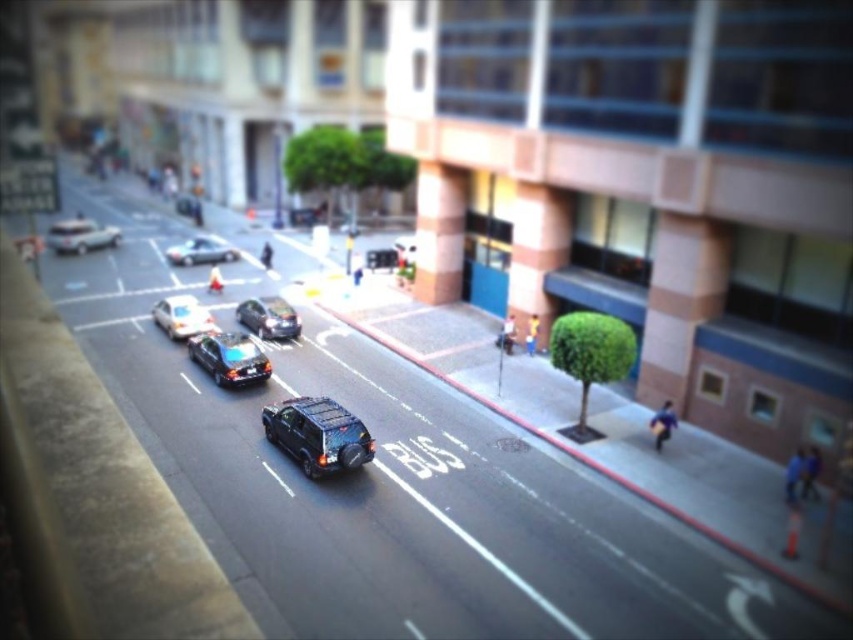
Question: Is shiny black car at center thinner than shiny silver sedan at center?

Choices:
 (A) yes
 (B) no

Answer: (A)

Question: Which point is farther to the camera?

Choices:
 (A) (225, 256)
 (B) (331, 472)
 (C) (276, 300)

Answer: (A)

Question: From the image, what is the correct spatial relationship of shiny black sedan at center in relation to matte silver sedan at center?

Choices:
 (A) right
 (B) left

Answer: (A)

Question: Can you confirm if shiny black car at center is bigger than shiny black sedan at center?

Choices:
 (A) yes
 (B) no

Answer: (A)

Question: Among these objects, which one is nearest to the camera?

Choices:
 (A) shiny silver sedan at center
 (B) shiny black sedan at center
 (C) matte black suv at center

Answer: (C)

Question: Estimate the real-world distances between objects in this image. Which object is farther from the shiny silver sedan at center?

Choices:
 (A) shiny black sedan at center
 (B) matte silver sedan at center
 (C) matte black suv at center
 (D) shiny silver taxi at center

Answer: (C)